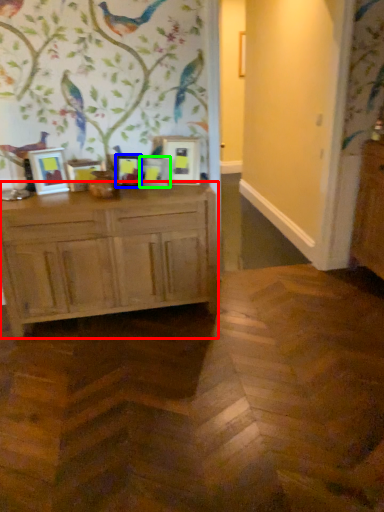
Question: Considering the real-world distances, which object is closest to chest of drawers (highlighted by a red box)? picture frame (highlighted by a blue box) or picture frame (highlighted by a green box).

Choices:
 (A) picture frame
 (B) picture frame

Answer: (A)